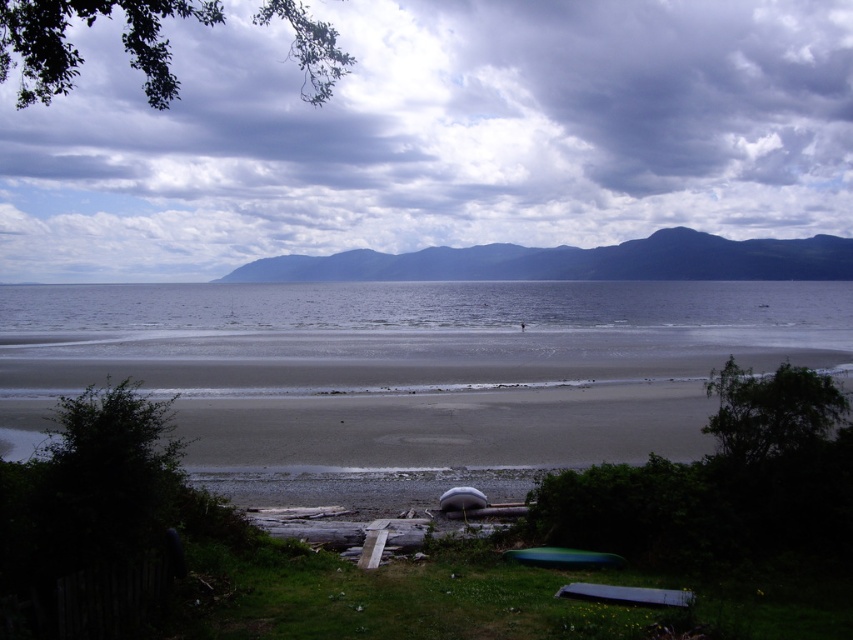
Question: Which point is farther to the camera?

Choices:
 (A) dark green forested mountain at upper center
 (B) cloudy sky at upper center

Answer: (B)

Question: Is cloudy sky at upper center wider than dark green forested mountain at upper center?

Choices:
 (A) no
 (B) yes

Answer: (B)

Question: Does cloudy sky at upper center appear on the right side of dark green forested mountain at upper center?

Choices:
 (A) no
 (B) yes

Answer: (A)

Question: Which object is farther from the camera taking this photo?

Choices:
 (A) dark green forested mountain at upper center
 (B) cloudy sky at upper center

Answer: (B)

Question: Does cloudy sky at upper center come in front of dark green forested mountain at upper center?

Choices:
 (A) yes
 (B) no

Answer: (B)